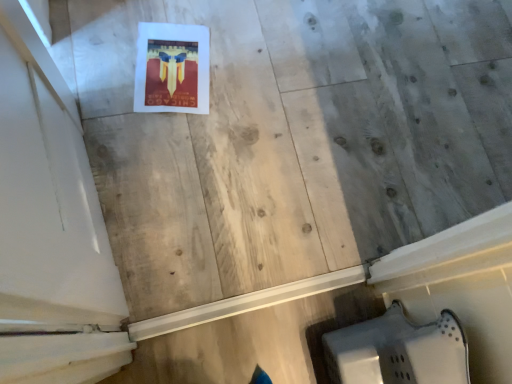
Locate an element on the screen. This screenshot has width=512, height=384. vacant space behind white matte door at upper left is located at coordinates (161, 97).